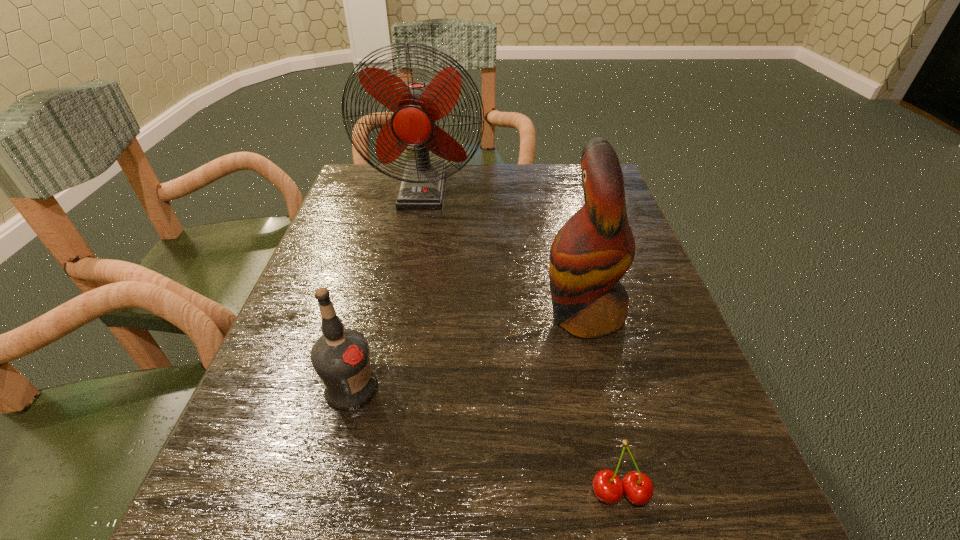
Locate an element on the screen. This screenshot has height=540, width=960. vacant position at the left edge of the desktop is located at coordinates (370, 260).

At what (x,y) coordinates should I click in order to perform the action: click on free space at the right edge. Please return your answer as a coordinate pair (x, y). The height and width of the screenshot is (540, 960). Looking at the image, I should click on (636, 272).

The width and height of the screenshot is (960, 540). In order to click on vacant area at the far left corner in this screenshot , I will do `click(385, 190)`.

The image size is (960, 540). Identify the location of vacant space at the near left corner. (199, 508).

This screenshot has height=540, width=960. In the image, there is a desktop. Find the location of `vacant space at the far right corner`. vacant space at the far right corner is located at coordinates (565, 187).

This screenshot has width=960, height=540. Find the location of `empty location between the farthest object and the cherry`. empty location between the farthest object and the cherry is located at coordinates (521, 341).

At what (x,y) coordinates should I click in order to perform the action: click on unoccupied position between the farthest object and the shortest object. Please return your answer as a coordinate pair (x, y). Looking at the image, I should click on (521, 341).

What are the coordinates of `free space between the third tallest object and the parrot` in the screenshot? It's located at (468, 351).

You are a GUI agent. You are given a task and a screenshot of the screen. Output one action in this format:
    pyautogui.click(x=<x>, y=<y>)
    Task: Click on the empty location between the cherry and the second farthest object
    Image resolution: width=960 pixels, height=540 pixels.
    Given the screenshot: What is the action you would take?
    pyautogui.click(x=602, y=403)

I want to click on vacant area that lies between the second farthest object and the vodka, so click(468, 351).